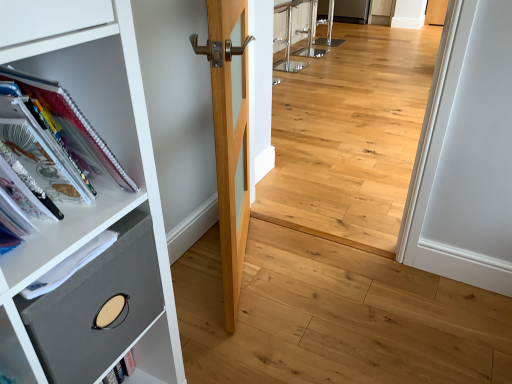
Question: Could you tell me if light wood door at center is facing spiral-bound paper at left?

Choices:
 (A) no
 (B) yes

Answer: (A)

Question: From a real-world perspective, is light wood door at center located higher than spiral-bound paper at left?

Choices:
 (A) no
 (B) yes

Answer: (A)

Question: Considering the relative sizes of light wood door at center and spiral-bound paper at left in the image provided, is light wood door at center thinner than spiral-bound paper at left?

Choices:
 (A) yes
 (B) no

Answer: (A)

Question: Is light wood door at center outside of spiral-bound paper at left?

Choices:
 (A) yes
 (B) no

Answer: (A)

Question: Is light wood door at center positioned far away from spiral-bound paper at left?

Choices:
 (A) no
 (B) yes

Answer: (A)

Question: Is point (58, 337) closer or farther from the camera than point (264, 190)?

Choices:
 (A) farther
 (B) closer

Answer: (B)

Question: In terms of width, does gray fabric drawer at left look wider or thinner when compared to natural wood floor at center?

Choices:
 (A) wide
 (B) thin

Answer: (A)

Question: Considering the positions of gray fabric drawer at left and natural wood floor at center in the image, is gray fabric drawer at left taller or shorter than natural wood floor at center?

Choices:
 (A) short
 (B) tall

Answer: (A)

Question: Relative to natural wood floor at center, is gray fabric drawer at left in front or behind?

Choices:
 (A) behind
 (B) front

Answer: (B)

Question: Is spiral-bound paper at left in front of or behind gray fabric drawer at left in the image?

Choices:
 (A) behind
 (B) front

Answer: (B)

Question: Choose the correct answer: Is spiral-bound paper at left inside gray fabric drawer at left or outside it?

Choices:
 (A) outside
 (B) inside

Answer: (A)

Question: Does point (93, 153) appear closer or farther from the camera than point (104, 286)?

Choices:
 (A) closer
 (B) farther

Answer: (A)

Question: From the image's perspective, is spiral-bound paper at left positioned above or below gray fabric drawer at left?

Choices:
 (A) below
 (B) above

Answer: (B)

Question: Based on their positions, is light wood door at center located to the left or right of natural wood floor at center?

Choices:
 (A) left
 (B) right

Answer: (A)

Question: From their relative heights in the image, would you say light wood door at center is taller or shorter than natural wood floor at center?

Choices:
 (A) tall
 (B) short

Answer: (A)